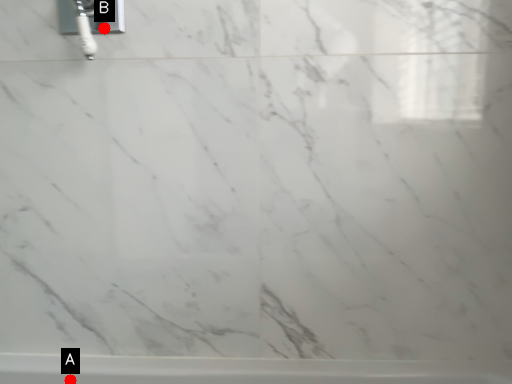
Question: Two points are circled on the image, labeled by A and B beside each circle. Which point appears farthest from the camera in this image?

Choices:
 (A) A is further
 (B) B is further

Answer: (A)